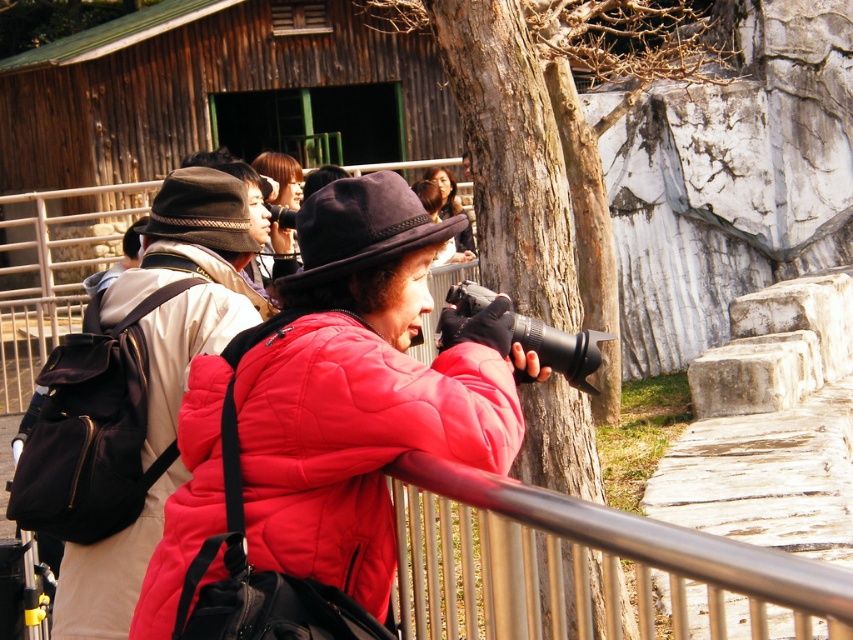
Question: Can you confirm if matte red puffer jacket at center is wider than matte black backpack at left?

Choices:
 (A) yes
 (B) no

Answer: (A)

Question: Is matte red puffer jacket at center wider than matte black backpack at left?

Choices:
 (A) no
 (B) yes

Answer: (B)

Question: Is matte red puffer jacket at center to the right of matte black backpack at left from the viewer's perspective?

Choices:
 (A) no
 (B) yes

Answer: (B)

Question: Which point is farther to the camera?

Choices:
 (A) [354, 412]
 (B) [84, 556]

Answer: (B)

Question: Which point is closer to the camera taking this photo?

Choices:
 (A) (172, 440)
 (B) (387, 360)

Answer: (B)